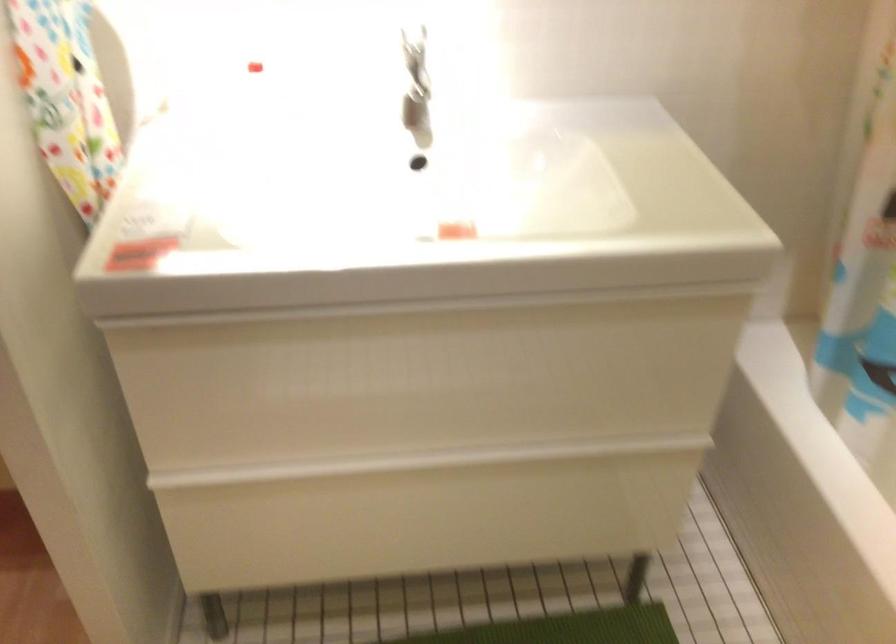
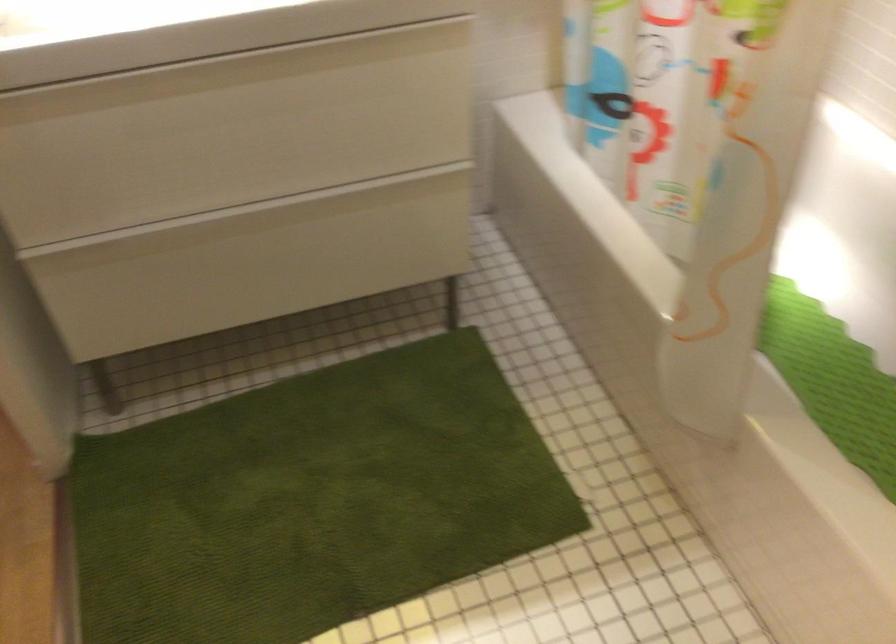
Question: The images are taken continuously from a first-person perspective. In which direction is your viewpoint rotating?

Choices:
 (A) Left
 (B) Right
 (C) Up
 (D) Down

Answer: (D)